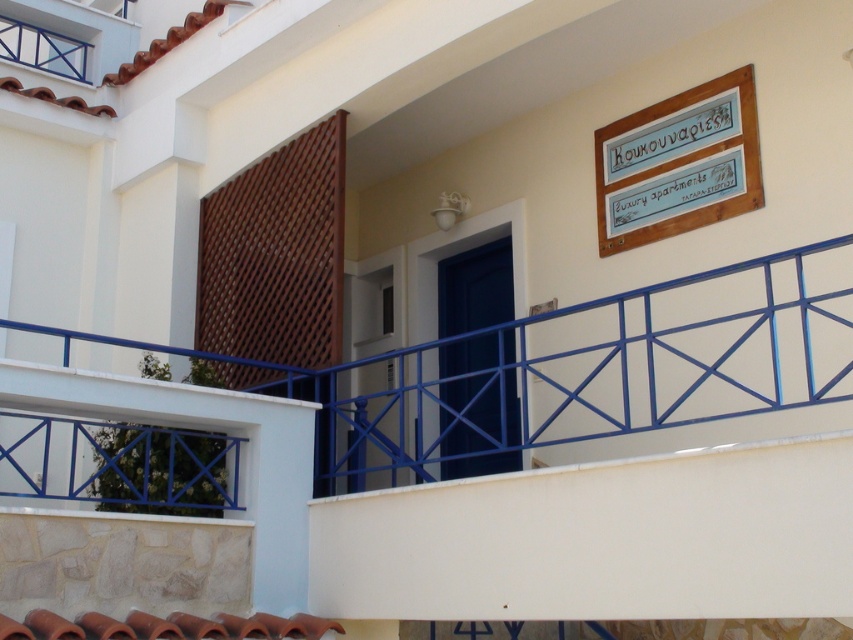
Can you confirm if white painted metal railing at lower center is wider than wooden signboard at upper right?

No, white painted metal railing at lower center is not wider than wooden signboard at upper right.

Can you confirm if white painted metal railing at lower center is positioned to the left of wooden signboard at upper right?

No, white painted metal railing at lower center is not to the left of wooden signboard at upper right.

Is point (93, 438) positioned before point (724, 104)?

Yes, point (93, 438) is closer to viewer.

The height and width of the screenshot is (640, 853). In order to click on white painted metal railing at lower center in this screenshot , I will do `click(567, 372)`.

Can you confirm if wooden signboard at upper right is positioned to the left of blue glossy door at center?

In fact, wooden signboard at upper right is to the right of blue glossy door at center.

Is wooden signboard at upper right closer to the viewer compared to blue glossy door at center?

That is True.

Image resolution: width=853 pixels, height=640 pixels. Describe the element at coordinates (679, 163) in the screenshot. I see `wooden signboard at upper right` at that location.

What are the coordinates of `wooden signboard at upper right` in the screenshot? It's located at (679, 163).

Which of these two, white painted metal railing at lower center or blue glossy door at center, stands taller?

blue glossy door at center

Describe the element at coordinates (567, 372) in the screenshot. Image resolution: width=853 pixels, height=640 pixels. I see `white painted metal railing at lower center` at that location.

Is point (57, 483) closer to camera compared to point (479, 282)?

Yes, it is in front of point (479, 282).

Find the location of a particular element. Image resolution: width=853 pixels, height=640 pixels. white painted metal railing at lower center is located at coordinates (567, 372).